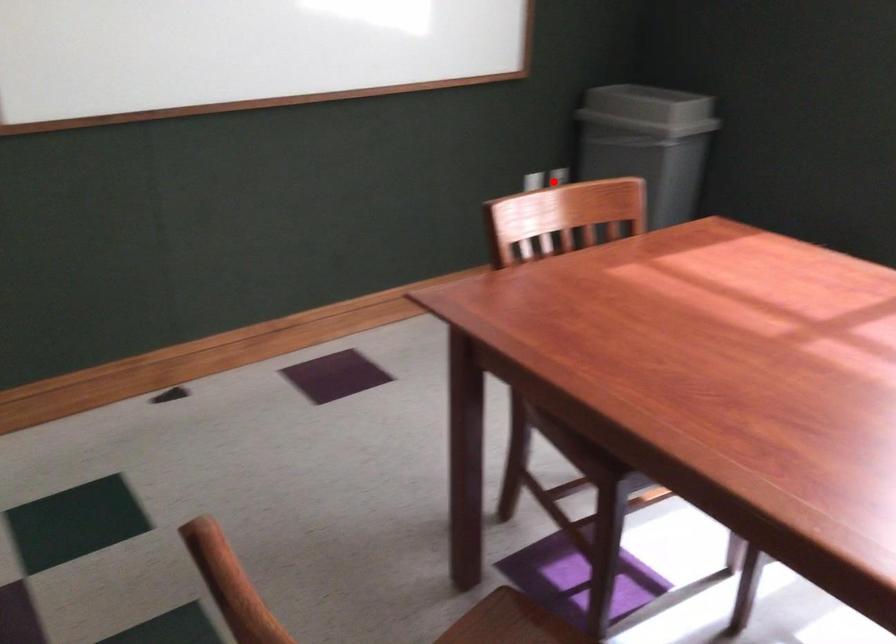
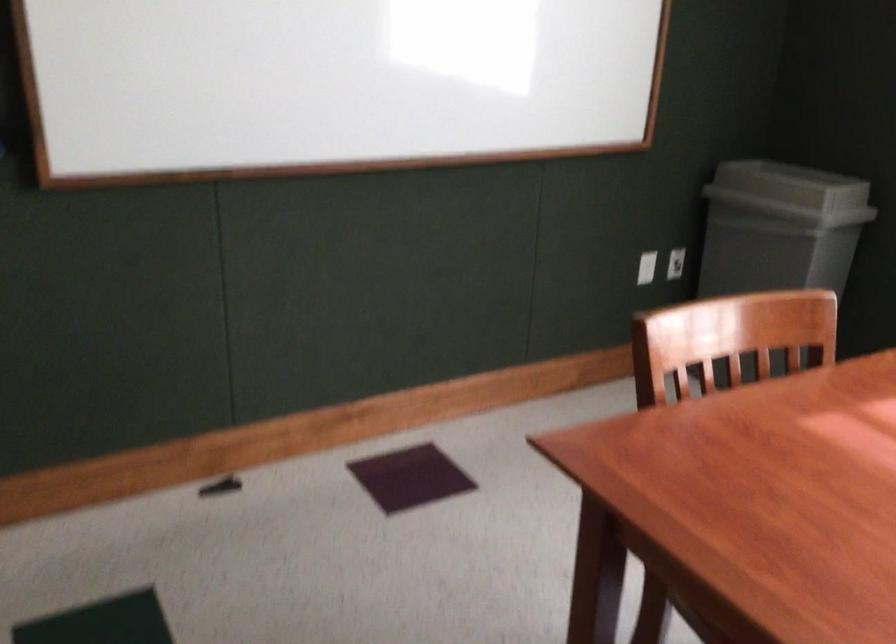
Question: I am providing you with two images of the same scene from different viewpoints. Given a red point in image1, look at the same physical point in image2. Is it:

Choices:
 (A) Closer to the viewpoint
 (B) Farther from the viewpoint

Answer: (A)